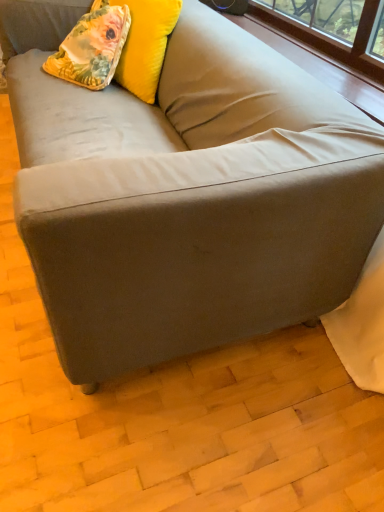
The width and height of the screenshot is (384, 512). Identify the location of floral fabric pillow at upper left. (92, 48).

Describe the element at coordinates (92, 48) in the screenshot. The image size is (384, 512). I see `floral fabric pillow at upper left` at that location.

Locate an element on the screen. The image size is (384, 512). floral fabric pillow at upper left is located at coordinates (144, 42).

This screenshot has height=512, width=384. What do you see at coordinates (144, 42) in the screenshot? I see `floral fabric pillow at upper left` at bounding box center [144, 42].

You are a GUI agent. You are given a task and a screenshot of the screen. Output one action in this format:
    pyautogui.click(x=<x>, y=<y>)
    Task: Click on the floral fabric pillow at upper left
    The width and height of the screenshot is (384, 512).
    Given the screenshot: What is the action you would take?
    pyautogui.click(x=92, y=48)

Considering the relative positions of floral fabric pillow at upper left and floral fabric pillow at upper left in the image provided, is floral fabric pillow at upper left to the left or to the right of floral fabric pillow at upper left?

Based on their positions, floral fabric pillow at upper left is located to the left of floral fabric pillow at upper left.

Is floral fabric pillow at upper left behind floral fabric pillow at upper left?

Yes, the depth of floral fabric pillow at upper left is greater than that of floral fabric pillow at upper left.

Does point (121, 16) come farther from viewer compared to point (178, 0)?

Yes.

From the image's perspective, who appears lower, floral fabric pillow at upper left or floral fabric pillow at upper left?

From the image's view, floral fabric pillow at upper left is below.

From the picture: From a real-world perspective, which object rests below the other?

floral fabric pillow at upper left is physically lower.

Does floral fabric pillow at upper left have a greater width compared to floral fabric pillow at upper left?

Correct, the width of floral fabric pillow at upper left exceeds that of floral fabric pillow at upper left.

In terms of height, does floral fabric pillow at upper left look taller or shorter compared to floral fabric pillow at upper left?

In the image, floral fabric pillow at upper left appears to be shorter than floral fabric pillow at upper left.

Can you confirm if floral fabric pillow at upper left is smaller than floral fabric pillow at upper left?

Correct, floral fabric pillow at upper left occupies less space than floral fabric pillow at upper left.

Would you say floral fabric pillow at upper left contains floral fabric pillow at upper left?

That's incorrect, floral fabric pillow at upper left is not inside floral fabric pillow at upper left.

Would you say floral fabric pillow at upper left is a long distance from floral fabric pillow at upper left?

No, floral fabric pillow at upper left is not far away from floral fabric pillow at upper left.

Could you tell me if floral fabric pillow at upper left is turned towards floral fabric pillow at upper left?

Yes.

How different are the orientations of floral fabric pillow at upper left and floral fabric pillow at upper left in degrees?

The facing directions of floral fabric pillow at upper left and floral fabric pillow at upper left are 8.48 degrees apart.

How far apart are floral fabric pillow at upper left and floral fabric pillow at upper left?

floral fabric pillow at upper left is 4.21 inches from floral fabric pillow at upper left.

Where is `pillow that appears on the right of floral fabric pillow at upper left`? Image resolution: width=384 pixels, height=512 pixels. pillow that appears on the right of floral fabric pillow at upper left is located at coordinates (144, 42).

Considering the positions of objects floral fabric pillow at upper left and floral fabric pillow at upper left in the image provided, who is more to the left, floral fabric pillow at upper left or floral fabric pillow at upper left?

floral fabric pillow at upper left is more to the left.

Between floral fabric pillow at upper left and floral fabric pillow at upper left, which one is positioned behind?

floral fabric pillow at upper left is more distant.

Does point (163, 41) lie in front of point (55, 63)?

Yes, it is.

From the image's perspective, would you say floral fabric pillow at upper left is positioned over floral fabric pillow at upper left?

Yes.

From a real-world perspective, which is physically below, floral fabric pillow at upper left or floral fabric pillow at upper left?

floral fabric pillow at upper left, from a real-world perspective.

Considering the relative sizes of floral fabric pillow at upper left and floral fabric pillow at upper left in the image provided, is floral fabric pillow at upper left thinner than floral fabric pillow at upper left?

Yes.

Which of these two, floral fabric pillow at upper left or floral fabric pillow at upper left, stands taller?

floral fabric pillow at upper left is taller.

Looking at the image, does floral fabric pillow at upper left seem bigger or smaller compared to floral fabric pillow at upper left?

Considering their sizes, floral fabric pillow at upper left takes up more space than floral fabric pillow at upper left.

Would you say floral fabric pillow at upper left is inside or outside floral fabric pillow at upper left?

floral fabric pillow at upper left is not enclosed by floral fabric pillow at upper left.

Is floral fabric pillow at upper left directly adjacent to floral fabric pillow at upper left?

No, floral fabric pillow at upper left is not with floral fabric pillow at upper left.

Is floral fabric pillow at upper left facing towards floral fabric pillow at upper left?

Yes, floral fabric pillow at upper left is facing floral fabric pillow at upper left.

Can you tell me how much floral fabric pillow at upper left and floral fabric pillow at upper left differ in facing direction?

The angular difference between floral fabric pillow at upper left and floral fabric pillow at upper left is 8.48 degrees.

Locate an element on the screen. This screenshot has width=384, height=512. pillow above the floral fabric pillow at upper left (from a real-world perspective) is located at coordinates (144, 42).

This screenshot has height=512, width=384. I want to click on throw pillow behind the floral fabric pillow at upper left, so click(92, 48).

Identify the location of throw pillow below the floral fabric pillow at upper left (from the image's perspective). (92, 48).